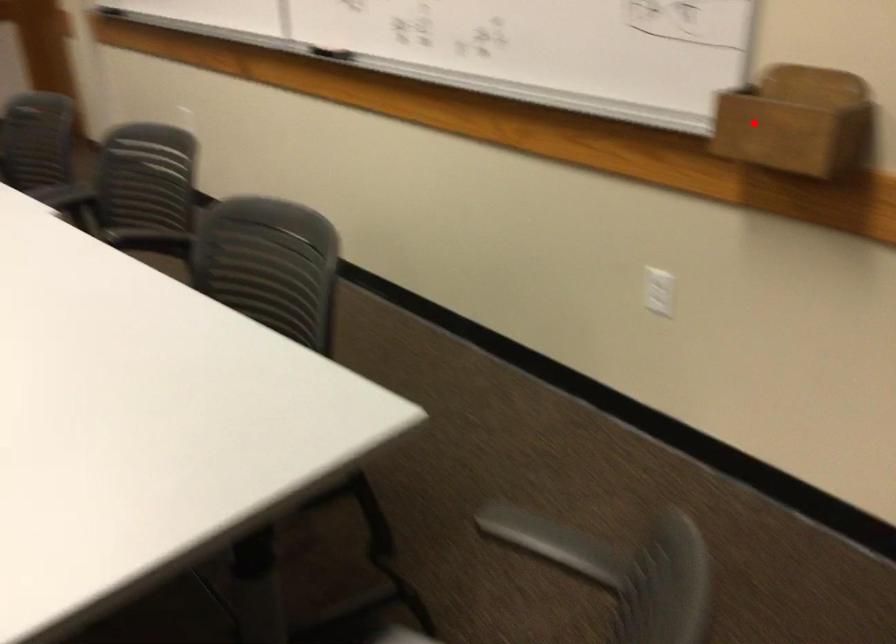
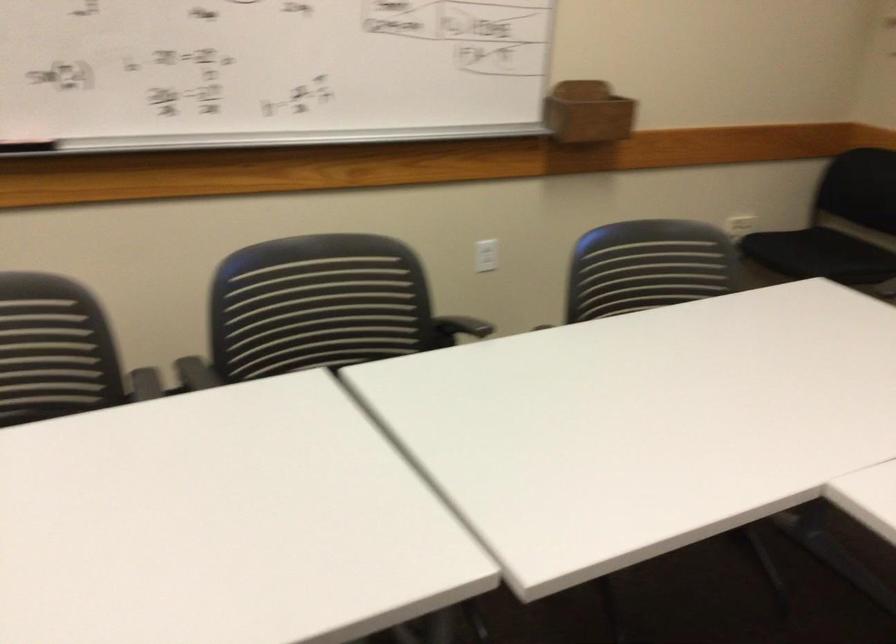
The point at the highlighted location is marked in the first image. Where is the corresponding point in the second image?

(588, 111)